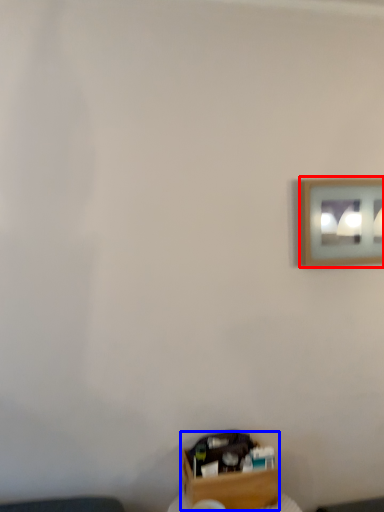
Question: Which object appears farthest to the camera in this image, picture frame (highlighted by a red box) or box (highlighted by a blue box)?

Choices:
 (A) picture frame
 (B) box

Answer: (A)